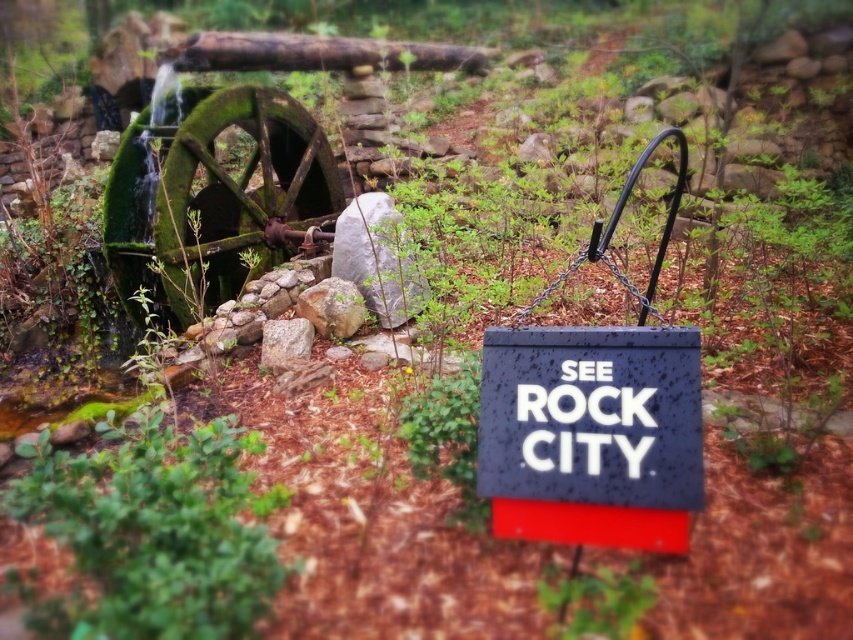
Question: Is black textured sign at center bigger than smooth brown log at upper center?

Choices:
 (A) no
 (B) yes

Answer: (A)

Question: Which of the following is the closest to the observer?

Choices:
 (A) smooth brown log at upper center
 (B) black textured sign at center

Answer: (B)

Question: Can you confirm if black textured sign at center is bigger than smooth brown log at upper center?

Choices:
 (A) yes
 (B) no

Answer: (B)

Question: Can you confirm if black textured sign at center is positioned to the right of smooth brown log at upper center?

Choices:
 (A) no
 (B) yes

Answer: (B)

Question: Which of the following is the farthest from the observer?

Choices:
 (A) (442, 64)
 (B) (558, 515)

Answer: (A)